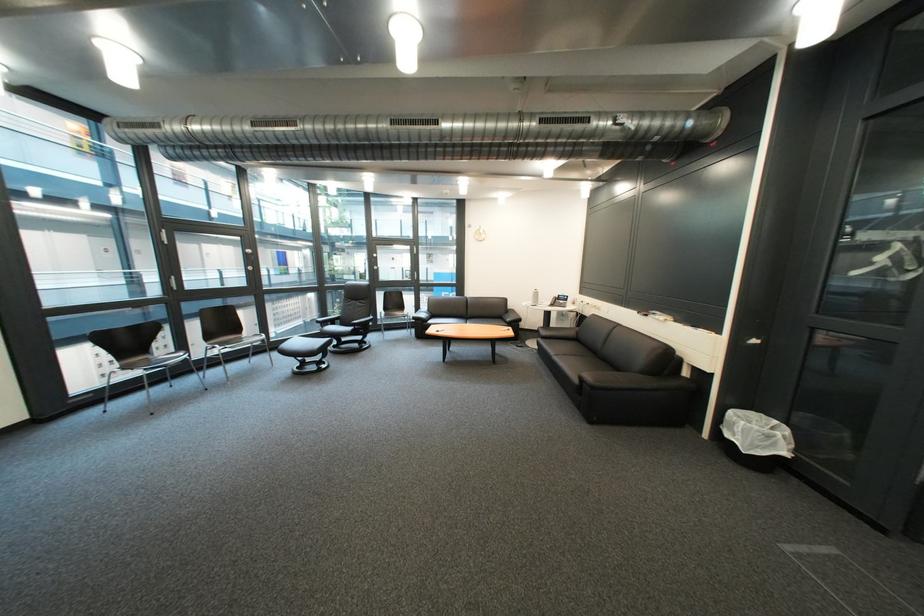
Where is `lounge chair armrest`? This screenshot has width=924, height=616. lounge chair armrest is located at coordinates tap(697, 386).